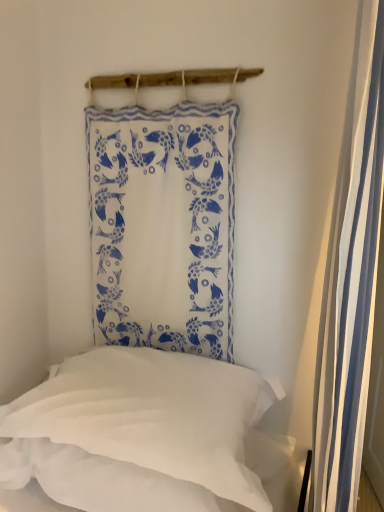
Describe the element at coordinates (163, 226) in the screenshot. The width and height of the screenshot is (384, 512). I see `white fabric with blue fish pattern at upper center` at that location.

You are a GUI agent. You are given a task and a screenshot of the screen. Output one action in this format:
    pyautogui.click(x=<x>, y=<y>)
    Task: Click on the white soft pillow at lower left
    
    Given the screenshot: What is the action you would take?
    pyautogui.click(x=143, y=428)

The width and height of the screenshot is (384, 512). Find the location of `curtain above the white striped fabric at right (from the image's perspective)`. curtain above the white striped fabric at right (from the image's perspective) is located at coordinates (163, 226).

Is point (325, 457) closer to viewer compared to point (98, 119)?

Yes, it is.

Can you confirm if white striped fabric at right is positioned to the right of white fabric with blue fish pattern at upper center?

Correct, you'll find white striped fabric at right to the right of white fabric with blue fish pattern at upper center.

Considering the sizes of objects white striped fabric at right and white fabric with blue fish pattern at upper center in the image provided, who is bigger, white striped fabric at right or white fabric with blue fish pattern at upper center?

white striped fabric at right.

Considering the relative sizes of white soft pillow at lower left and white fabric with blue fish pattern at upper center in the image provided, is white soft pillow at lower left bigger than white fabric with blue fish pattern at upper center?

Yes, white soft pillow at lower left is bigger than white fabric with blue fish pattern at upper center.

Is point (103, 412) closer to viewer compared to point (187, 287)?

Yes.

Consider the image. Considering the relative positions of white soft pillow at lower left and white fabric with blue fish pattern at upper center in the image provided, is white soft pillow at lower left to the left of white fabric with blue fish pattern at upper center from the viewer's perspective?

Correct, you'll find white soft pillow at lower left to the left of white fabric with blue fish pattern at upper center.

From the image's perspective, is white soft pillow at lower left located above white fabric with blue fish pattern at upper center?

Actually, white soft pillow at lower left appears below white fabric with blue fish pattern at upper center in the image.

In the scene shown: From a real-world perspective, is white soft pillow at lower left physically above white striped fabric at right?

No, from a real-world perspective, white soft pillow at lower left is not on top of white striped fabric at right.

Is white soft pillow at lower left looking in the opposite direction of white striped fabric at right?

No.

Is white soft pillow at lower left smaller than white striped fabric at right?

Correct, white soft pillow at lower left occupies less space than white striped fabric at right.

Consider the image. Considering the relative positions of white fabric with blue fish pattern at upper center and white soft pillow at lower left in the image provided, is white fabric with blue fish pattern at upper center to the right of white soft pillow at lower left from the viewer's perspective?

Yes.

From the image's perspective, is white fabric with blue fish pattern at upper center above or below white soft pillow at lower left?

From the image's perspective, white fabric with blue fish pattern at upper center appears above white soft pillow at lower left.

From the picture: Relative to white soft pillow at lower left, is white fabric with blue fish pattern at upper center in front or behind?

white fabric with blue fish pattern at upper center is positioned farther from the viewer than white soft pillow at lower left.

How many degrees apart are the facing directions of white fabric with blue fish pattern at upper center and white soft pillow at lower left?

There is a 0.0802-degree angle between the facing directions of white fabric with blue fish pattern at upper center and white soft pillow at lower left.

Considering the sizes of objects white striped fabric at right and white soft pillow at lower left in the image provided, who is wider, white striped fabric at right or white soft pillow at lower left?

Wider between the two is white soft pillow at lower left.

Is white striped fabric at right oriented away from white soft pillow at lower left?

Correct, white striped fabric at right is looking away from white soft pillow at lower left.

Considering the relative sizes of white striped fabric at right and white soft pillow at lower left in the image provided, is white striped fabric at right smaller than white soft pillow at lower left?

Incorrect, white striped fabric at right is not smaller in size than white soft pillow at lower left.

Where is `shower curtain above the white soft pillow at lower left (from a real-world perspective)`? Image resolution: width=384 pixels, height=512 pixels. shower curtain above the white soft pillow at lower left (from a real-world perspective) is located at coordinates (350, 279).

Can you confirm if white fabric with blue fish pattern at upper center is smaller than white striped fabric at right?

Indeed, white fabric with blue fish pattern at upper center has a smaller size compared to white striped fabric at right.

Does white fabric with blue fish pattern at upper center contain white striped fabric at right?

No, white striped fabric at right is not a part of white fabric with blue fish pattern at upper center.

From a real-world perspective, is white fabric with blue fish pattern at upper center on top of white striped fabric at right?

Yes, from a real-world perspective, white fabric with blue fish pattern at upper center is over white striped fabric at right

Locate an element on the screen. The width and height of the screenshot is (384, 512). shower curtain that appears below the white fabric with blue fish pattern at upper center (from the image's perspective) is located at coordinates (350, 279).

You are a GUI agent. You are given a task and a screenshot of the screen. Output one action in this format:
    pyautogui.click(x=<x>, y=<y>)
    Task: Click on the curtain above the white soft pillow at lower left (from the image's perspective)
    This screenshot has width=384, height=512.
    Given the screenshot: What is the action you would take?
    pyautogui.click(x=163, y=226)

From the image, which object appears to be nearer to white soft pillow at lower left, white fabric with blue fish pattern at upper center or white striped fabric at right?

Answer: white fabric with blue fish pattern at upper center lies closer to white soft pillow at lower left than the other object.

Looking at the image, which one is located closer to white fabric with blue fish pattern at upper center, white soft pillow at lower left or white striped fabric at right?

The object closer to white fabric with blue fish pattern at upper center is white soft pillow at lower left.

Looking at the image, which one is located closer to white striped fabric at right, white soft pillow at lower left or white fabric with blue fish pattern at upper center?

Based on the image, white soft pillow at lower left appears to be nearer to white striped fabric at right.

Looking at the image, which one is located further to white soft pillow at lower left, white striped fabric at right or white fabric with blue fish pattern at upper center?

white striped fabric at right lies further to white soft pillow at lower left than the other object.

Based on their spatial positions, is white striped fabric at right or white soft pillow at lower left closer to white fabric with blue fish pattern at upper center?

white soft pillow at lower left is closer to white fabric with blue fish pattern at upper center.

From the image, which object appears to be farther from white striped fabric at right, white fabric with blue fish pattern at upper center or white soft pillow at lower left?

white fabric with blue fish pattern at upper center lies further to white striped fabric at right than the other object.

The height and width of the screenshot is (512, 384). I want to click on pillow between white striped fabric at right and white fabric with blue fish pattern at upper center from front to back, so click(x=143, y=428).